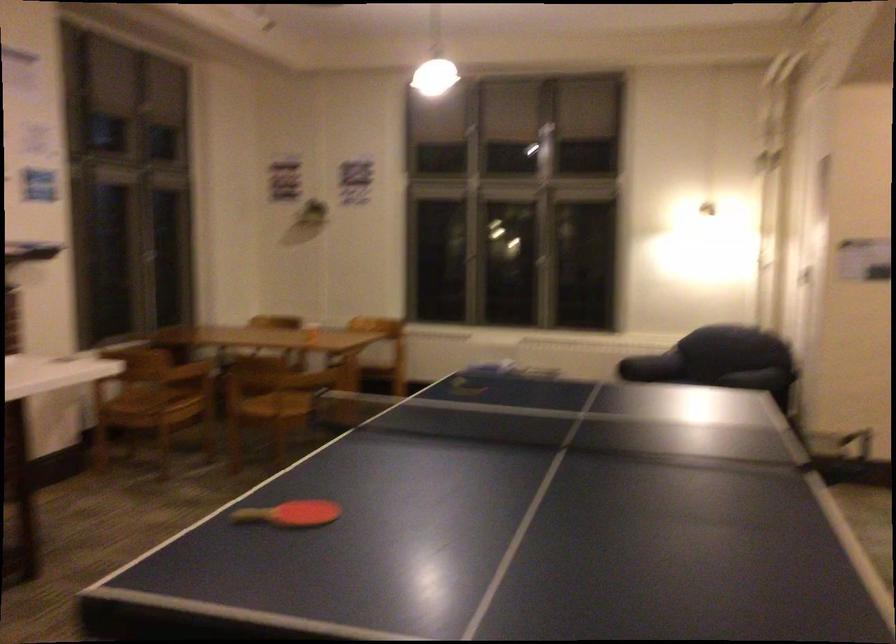
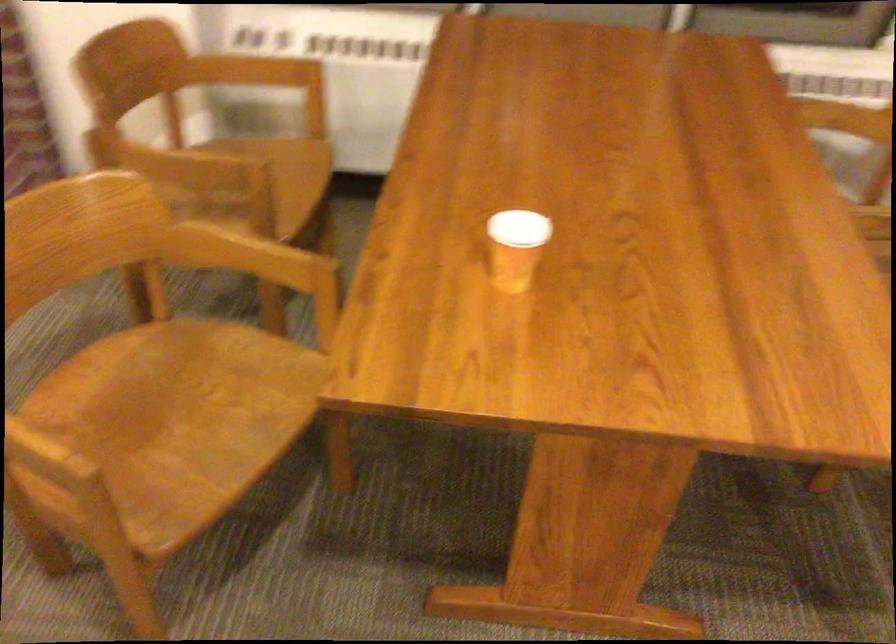
Find the pixel in the second image that matches pixel 316 327 in the first image.

(515, 247)